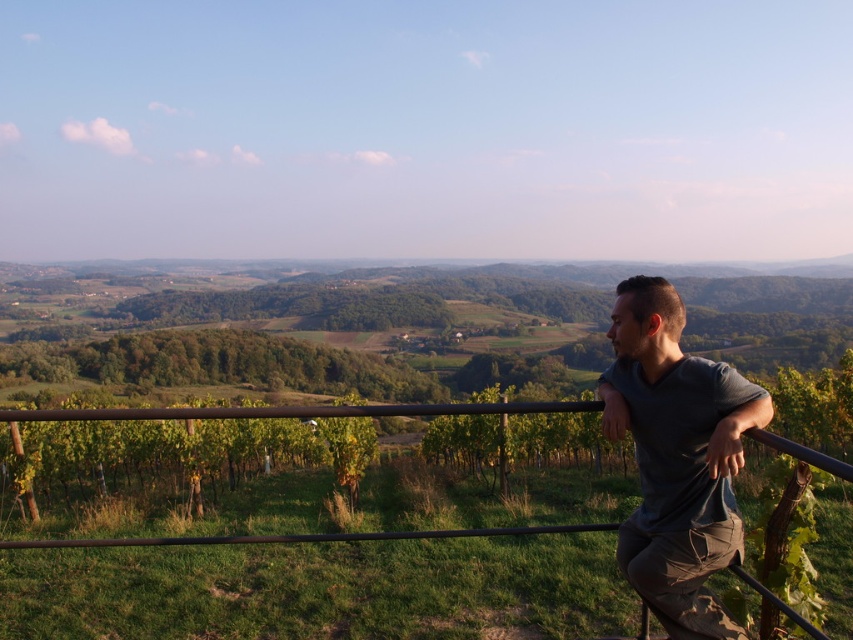
You are a tailor measuring fabrics for a new project. You have a piece of fabric that is exactly the same width as the black metal fence at lower right. Can you determine if the gray cotton shirt at right can be made from this fabric without needing to cut it lengthwise?

The gray cotton shirt at right has a width less than the black metal fence at lower right. Since the fabric is the same width as the fence, the shirt can be made without cutting it lengthwise because its width is smaller and will fit within the fabric width.

You are a photographer trying to capture the gray cotton shirt at right and the black metal fence at lower right in the same frame. Which object should you position closer to the bottom of your camera viewfinder to include both in the composition?

To include both the gray cotton shirt at right and the black metal fence at lower right in the composition, position the black metal fence at lower right closer to the bottom of the camera viewfinder since the gray cotton shirt at right is located above it.